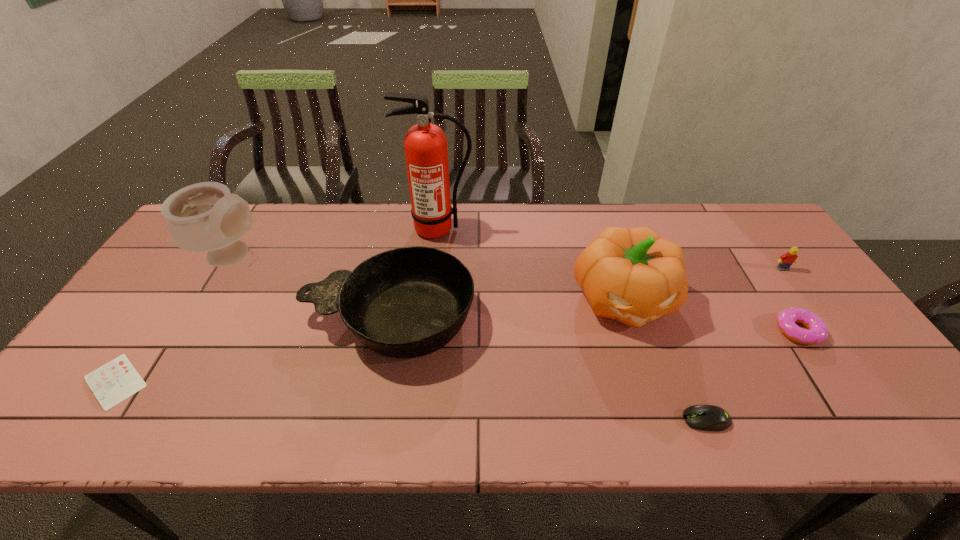
I want to click on fire extinguisher, so click(426, 151).

Where is `pottery`? pottery is located at coordinates (204, 217).

This screenshot has height=540, width=960. What are the coordinates of `the third tallest object` in the screenshot? It's located at (632, 275).

You are a GUI agent. You are given a task and a screenshot of the screen. Output one action in this format:
    pyautogui.click(x=<x>, y=<y>)
    Task: Click on the fourth tallest object
    
    Given the screenshot: What is the action you would take?
    pyautogui.click(x=408, y=302)

Find the location of a particular element. The width and height of the screenshot is (960, 540). Lego is located at coordinates (786, 260).

This screenshot has height=540, width=960. What are the coordinates of `doughnut` in the screenshot? It's located at (817, 332).

You are a GUI agent. You are given a task and a screenshot of the screen. Output one action in this format:
    pyautogui.click(x=<x>, y=<y>)
    Task: Click on the computer mouse
    
    Given the screenshot: What is the action you would take?
    pyautogui.click(x=702, y=417)

Find the location of a particular element. The image size is (960, 540). diary is located at coordinates (117, 380).

Identify the location of vacant space positioned on the handle side of the tallest object. The image size is (960, 540). (432, 277).

At what (x,y) coordinates should I click in order to perform the action: click on free spot located on the right of the seventh shortest object. Please return your answer as a coordinate pair (x, y). Looking at the image, I should click on coord(395,256).